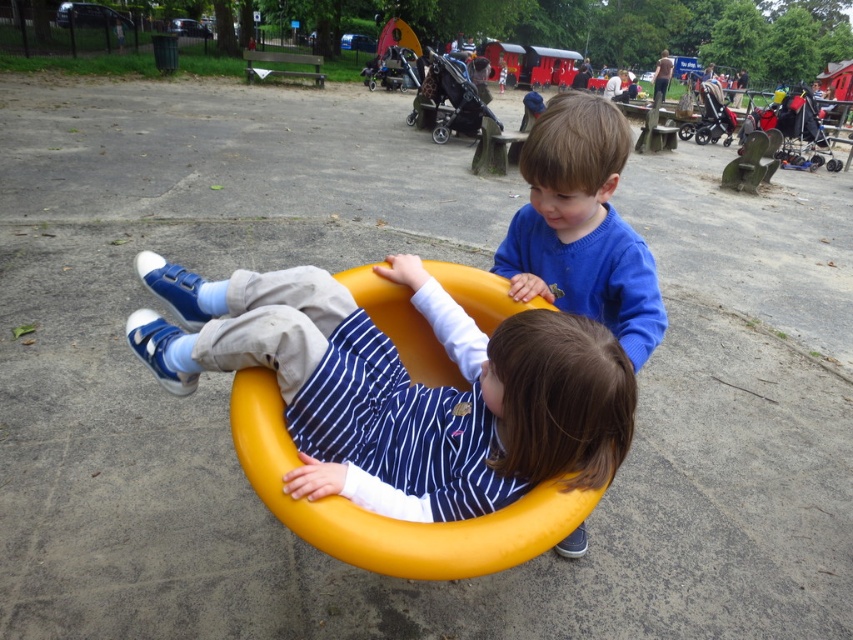
Question: Does matte yellow swing at center come behind blue knit sweater at upper center?

Choices:
 (A) no
 (B) yes

Answer: (A)

Question: Is matte yellow swing at center to the right of blue knit sweater at upper center from the viewer's perspective?

Choices:
 (A) yes
 (B) no

Answer: (B)

Question: Among these points, which one is farthest from the camera?

Choices:
 (A) (489, 362)
 (B) (622, 227)

Answer: (B)

Question: Among these points, which one is farthest from the camera?

Choices:
 (A) (595, 104)
 (B) (392, 260)

Answer: (B)

Question: Is matte yellow swing at center bigger than blue knit sweater at upper center?

Choices:
 (A) no
 (B) yes

Answer: (B)